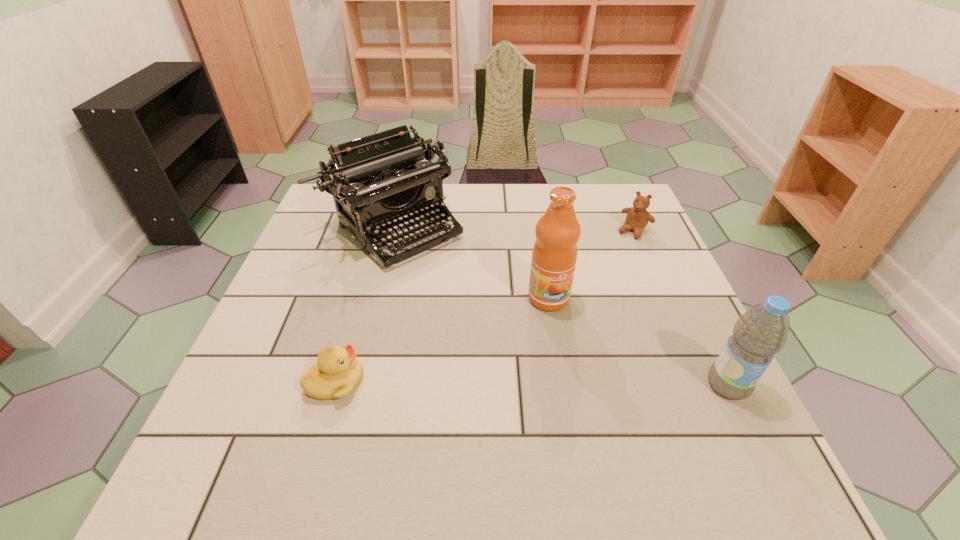
Find the location of a particular element. The image size is (960, 540). vacant space located 0.110m on the label side of the tallest object is located at coordinates (574, 351).

This screenshot has width=960, height=540. In order to click on vacant space located on the keyboard of the typewriter in this screenshot , I will do `click(486, 312)`.

Locate an element on the screen. Image resolution: width=960 pixels, height=540 pixels. blank space located on the keyboard of the typewriter is located at coordinates (535, 356).

Find the location of `vacant space located 0.240m on the keyboard of the typewriter`. vacant space located 0.240m on the keyboard of the typewriter is located at coordinates 492,316.

This screenshot has width=960, height=540. I want to click on vacant space located on the face of the teddy bear, so click(x=587, y=294).

You are a GUI agent. You are given a task and a screenshot of the screen. Output one action in this format:
    pyautogui.click(x=<x>, y=<y>)
    Task: Click on the free space located on the face of the teddy bear
    
    Given the screenshot: What is the action you would take?
    pyautogui.click(x=592, y=287)

Locate an element on the screen. free location located on the face of the teddy bear is located at coordinates (571, 315).

This screenshot has width=960, height=540. What are the coordinates of `typewriter located in the far edge section of the desktop` in the screenshot? It's located at (383, 181).

I want to click on teddy bear present at the far edge, so click(637, 218).

This screenshot has width=960, height=540. I want to click on duckling that is at the near edge, so click(x=337, y=372).